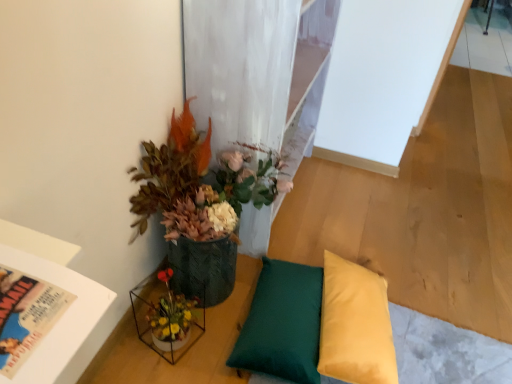
At what (x,y) coordinates should I click in order to perform the action: click on free space in front of translucent glass vase at lower left. Please return your answer as a coordinate pair (x, y). This screenshot has height=384, width=512. Looking at the image, I should click on (161, 371).